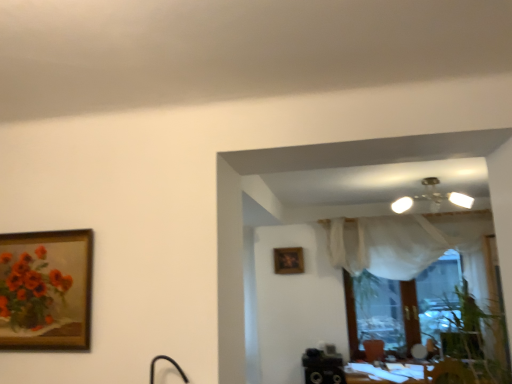
Question: Based on their sizes in the image, would you say matte floral painting at left is bigger or smaller than wooden frame at center?

Choices:
 (A) big
 (B) small

Answer: (A)

Question: Is matte floral painting at left inside or outside of wooden frame at center?

Choices:
 (A) inside
 (B) outside

Answer: (B)

Question: Which is farther from the matte floral painting at left?

Choices:
 (A) white glossy table at lower right
 (B) wooden frame at center

Answer: (A)

Question: Which object is positioned closest to the wooden frame at center?

Choices:
 (A) white glossy table at lower right
 (B) matte floral painting at left

Answer: (A)